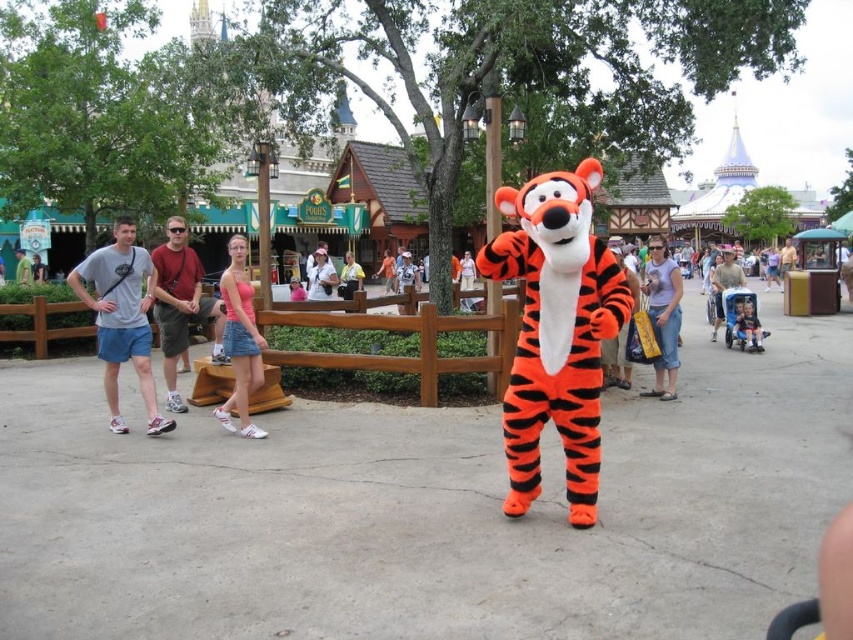
Is matte gray t-shirt at left bigger than matte gray shirt at left?

No, matte gray t-shirt at left is not bigger than matte gray shirt at left.

Who is more forward, [167,424] or [183,250]?

Positioned in front is point [167,424].

At what (x,y) coordinates should I click in order to perform the action: click on matte gray t-shirt at left. Please return your answer as a coordinate pair (x, y). Looking at the image, I should click on (120, 317).

From the picture: Is the position of orange plush tiger at center more distant than that of pink fabric dress at center?

No, it is not.

Does point (590, 448) come closer to viewer compared to point (322, 248)?

Yes, point (590, 448) is in front of point (322, 248).

At what (x,y) coordinates should I click in order to perform the action: click on orange plush tiger at center. Please return your answer as a coordinate pair (x, y). Looking at the image, I should click on (556, 330).

Between orange plush tiger at center and pink denim shorts at center, which one is positioned higher?

pink denim shorts at center

The image size is (853, 640). Identify the location of orange plush tiger at center. (556, 330).

Is point (579, 275) closer to viewer compared to point (235, 268)?

That is True.

You are a GUI agent. You are given a task and a screenshot of the screen. Output one action in this format:
    pyautogui.click(x=<x>, y=<y>)
    Task: Click on the orange plush tiger at center
    Image resolution: width=853 pixels, height=640 pixels.
    Given the screenshot: What is the action you would take?
    pyautogui.click(x=556, y=330)